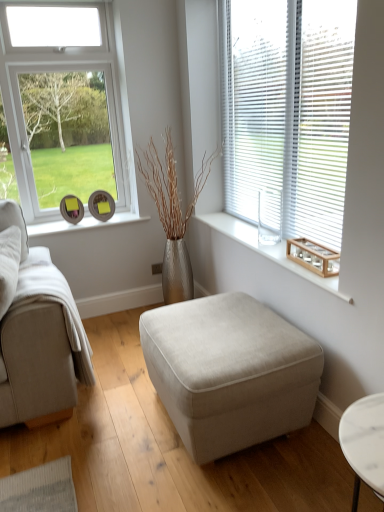
Question: Does white plastic blinds at upper right have a greater width compared to beige fabric ottoman at center?

Choices:
 (A) no
 (B) yes

Answer: (A)

Question: Is white plastic blinds at upper right at the left side of beige fabric ottoman at center?

Choices:
 (A) no
 (B) yes

Answer: (A)

Question: From a real-world perspective, is white plastic blinds at upper right on top of beige fabric ottoman at center?

Choices:
 (A) yes
 (B) no

Answer: (A)

Question: Is white plastic blinds at upper right thinner than beige fabric ottoman at center?

Choices:
 (A) yes
 (B) no

Answer: (A)

Question: Does white plastic blinds at upper right touch beige fabric ottoman at center?

Choices:
 (A) yes
 (B) no

Answer: (B)

Question: From a real-world perspective, is beige fabric ottoman at center above or below white plastic blinds at upper right?

Choices:
 (A) above
 (B) below

Answer: (B)

Question: Considering the positions of point (185, 385) and point (268, 160), is point (185, 385) closer or farther from the camera than point (268, 160)?

Choices:
 (A) farther
 (B) closer

Answer: (B)

Question: Relative to white plastic blinds at upper right, is beige fabric ottoman at center in front or behind?

Choices:
 (A) front
 (B) behind

Answer: (A)

Question: Is beige fabric ottoman at center situated inside white plastic blinds at upper right or outside?

Choices:
 (A) inside
 (B) outside

Answer: (B)

Question: From the image's perspective, is white plastic blinds at upper right above or below wooden box at right?

Choices:
 (A) below
 (B) above

Answer: (B)

Question: In terms of height, does white plastic blinds at upper right look taller or shorter compared to wooden box at right?

Choices:
 (A) short
 (B) tall

Answer: (B)

Question: Is white plastic blinds at upper right in front of or behind wooden box at right in the image?

Choices:
 (A) front
 (B) behind

Answer: (A)

Question: From a real-world perspective, is white plastic blinds at upper right physically located above or below wooden box at right?

Choices:
 (A) above
 (B) below

Answer: (A)

Question: Looking at the image, does wooden box at right seem bigger or smaller compared to wooden tray at right?

Choices:
 (A) small
 (B) big

Answer: (A)

Question: Does point (321, 257) appear closer or farther from the camera than point (238, 225)?

Choices:
 (A) closer
 (B) farther

Answer: (A)